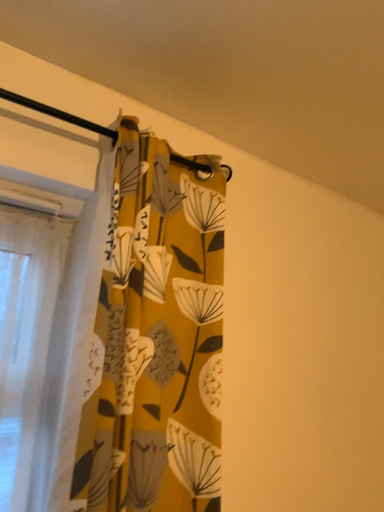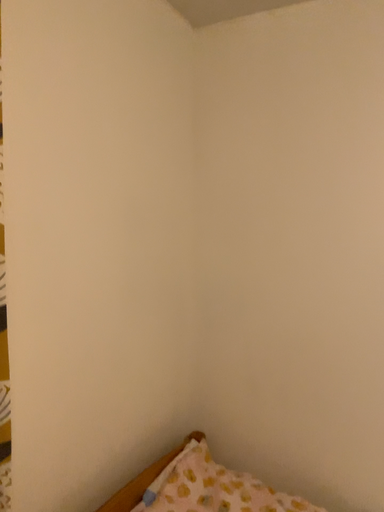
Question: Which way did the camera rotate in the video?

Choices:
 (A) rotated left
 (B) rotated right

Answer: (B)